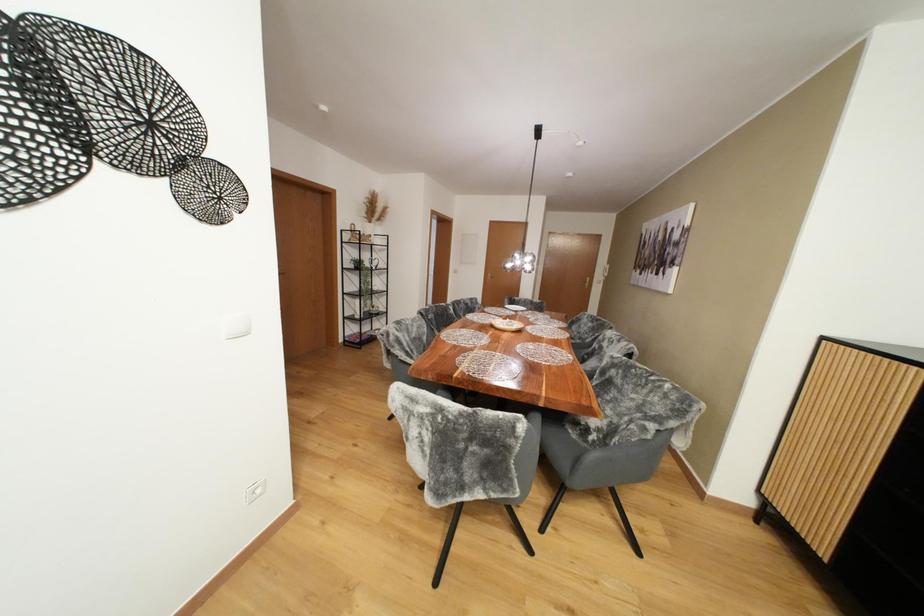
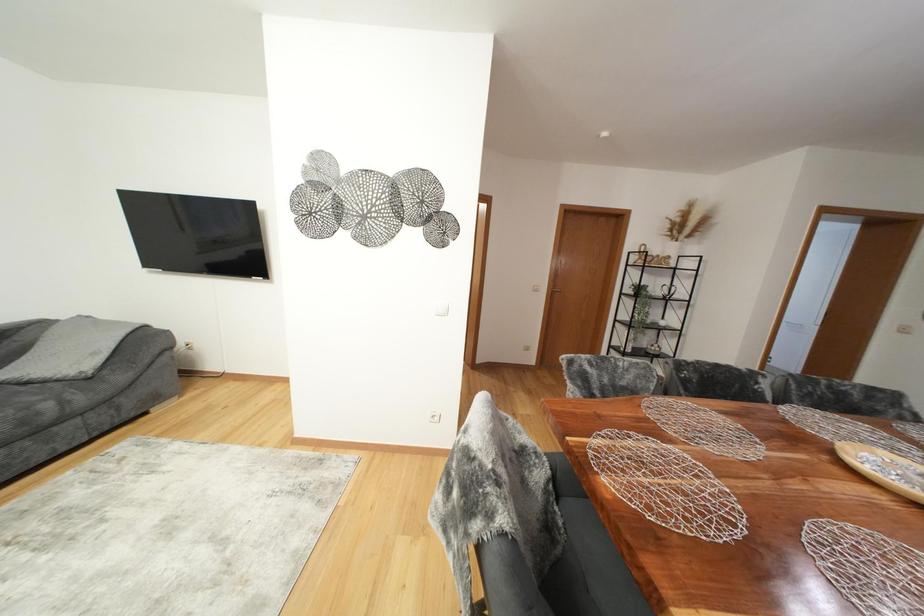
Question: The camera is either moving clockwise (left) or counter-clockwise (right) around the object. The first image is from the beginning of the video and the second image is from the end. Is the camera moving left or right when shooting the video?

Choices:
 (A) Left
 (B) Right

Answer: (B)